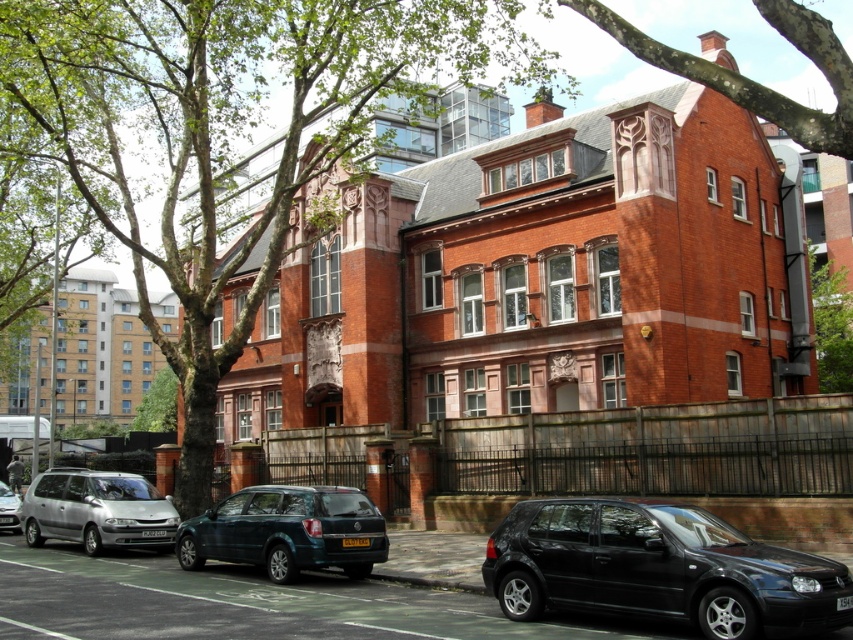
Is the position of green leafy tree at upper left less distant than that of silver metallic van at lower left?

Yes.

Between green leafy tree at upper left and silver metallic van at lower left, which one has more height?

green leafy tree at upper left

Where is `green leafy tree at upper left`? The height and width of the screenshot is (640, 853). green leafy tree at upper left is located at coordinates (225, 132).

Locate an element on the screen. This screenshot has height=640, width=853. green leafy tree at upper left is located at coordinates (225, 132).

Between green leafy tree at upper left and green leafy tree at upper center, which one has more height?

With more height is green leafy tree at upper left.

Can you confirm if green leafy tree at upper left is shorter than green leafy tree at upper center?

In fact, green leafy tree at upper left may be taller than green leafy tree at upper center.

You are a GUI agent. You are given a task and a screenshot of the screen. Output one action in this format:
    pyautogui.click(x=<x>, y=<y>)
    Task: Click on the green leafy tree at upper left
    The height and width of the screenshot is (640, 853).
    Given the screenshot: What is the action you would take?
    pyautogui.click(x=225, y=132)

I want to click on green leafy tree at upper left, so click(x=225, y=132).

Is green leafy tree at upper left closer to the viewer compared to black matte hatchback at lower right?

That is False.

Is green leafy tree at upper left behind black matte hatchback at lower right?

Yes, green leafy tree at upper left is further from the viewer.

Find the location of a particular element. green leafy tree at upper left is located at coordinates (225, 132).